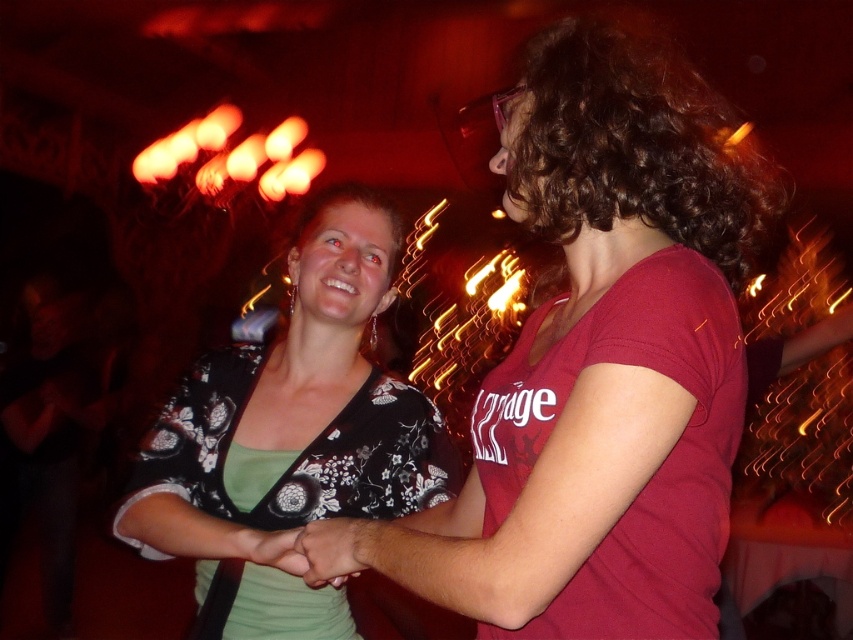
Question: Is floral-patterned blouse at center further to camera compared to smooth skin hand at center?

Choices:
 (A) yes
 (B) no

Answer: (A)

Question: Which point is farther to the camera?

Choices:
 (A) click(x=407, y=490)
 (B) click(x=578, y=508)
 (C) click(x=584, y=44)

Answer: (A)

Question: From the image, what is the correct spatial relationship of floral-patterned blouse at center in relation to dark brown curly hair at upper right?

Choices:
 (A) right
 (B) left

Answer: (B)

Question: Is dark brown curly hair at upper right bigger than smooth skin hand at center?

Choices:
 (A) yes
 (B) no

Answer: (A)

Question: Which point appears closest to the camera in this image?

Choices:
 (A) (355, 458)
 (B) (563, 48)
 (C) (340, 541)

Answer: (C)

Question: Which of the following is the closest to the observer?

Choices:
 (A) floral-patterned blouse at center
 (B) matte floral blouse at center
 (C) dark brown curly hair at upper right

Answer: (B)